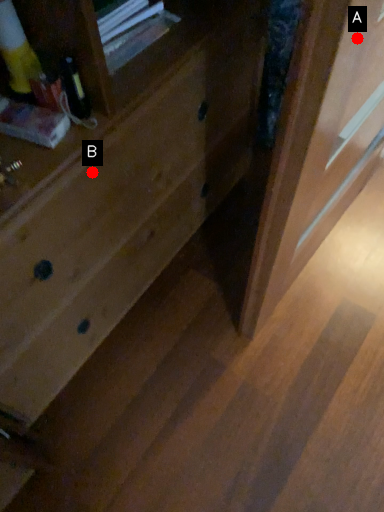
Question: Two points are circled on the image, labeled by A and B beside each circle. Which of the following is the farthest from the observer?

Choices:
 (A) A is further
 (B) B is further

Answer: (B)